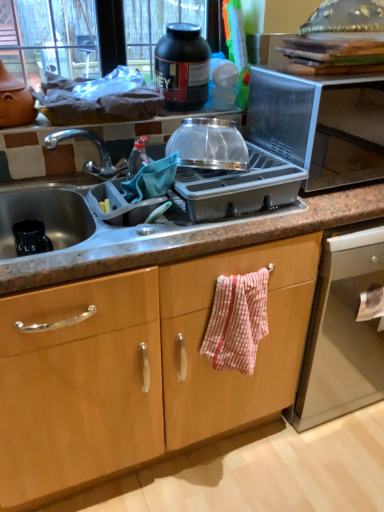
Question: Is red and white checkered fabric at center further to camera compared to granite gray sink at center?

Choices:
 (A) no
 (B) yes

Answer: (B)

Question: From the image's perspective, would you say red and white checkered fabric at center is shown under granite gray sink at center?

Choices:
 (A) yes
 (B) no

Answer: (A)

Question: Is red and white checkered fabric at center facing away from granite gray sink at center?

Choices:
 (A) no
 (B) yes

Answer: (B)

Question: Considering the relative sizes of red and white checkered fabric at center and granite gray sink at center in the image provided, is red and white checkered fabric at center smaller than granite gray sink at center?

Choices:
 (A) yes
 (B) no

Answer: (A)

Question: Is red and white checkered fabric at center facing towards granite gray sink at center?

Choices:
 (A) yes
 (B) no

Answer: (B)

Question: Is granite gray sink at center situated inside black plastic jar at upper center, the first kitchen appliance viewed from the top, or outside?

Choices:
 (A) inside
 (B) outside

Answer: (B)

Question: In the image, is granite gray sink at center positioned in front of or behind black plastic jar at upper center, the first kitchen appliance viewed from the top?

Choices:
 (A) behind
 (B) front

Answer: (B)

Question: Looking at the image, does granite gray sink at center seem bigger or smaller compared to black plastic jar at upper center, positioned as the 2th kitchen appliance in bottom-to-top order?

Choices:
 (A) small
 (B) big

Answer: (B)

Question: Visually, is granite gray sink at center positioned to the left or to the right of black plastic jar at upper center, positioned as the 2th kitchen appliance in bottom-to-top order?

Choices:
 (A) left
 (B) right

Answer: (A)

Question: From a real-world perspective, is transparent plastic bowl at upper center, the first kitchen appliance ordered from the bottom, above or below transparent plastic microwave at upper right?

Choices:
 (A) above
 (B) below

Answer: (A)

Question: Is transparent plastic bowl at upper center, arranged as the 2th kitchen appliance when viewed from the top, taller or shorter than transparent plastic microwave at upper right?

Choices:
 (A) short
 (B) tall

Answer: (A)

Question: Visually, is transparent plastic bowl at upper center, which is the first kitchen appliance from front to back, positioned to the left or to the right of transparent plastic microwave at upper right?

Choices:
 (A) right
 (B) left

Answer: (B)

Question: Would you say transparent plastic bowl at upper center, the first kitchen appliance ordered from the bottom, is inside or outside transparent plastic microwave at upper right?

Choices:
 (A) inside
 (B) outside

Answer: (B)

Question: Considering the positions of transparent plastic bowl at upper center, the second kitchen appliance in the back-to-front sequence, and red and white checkered fabric at center in the image, is transparent plastic bowl at upper center, the second kitchen appliance in the back-to-front sequence, taller or shorter than red and white checkered fabric at center?

Choices:
 (A) tall
 (B) short

Answer: (B)

Question: Is point (203, 136) closer or farther from the camera than point (231, 340)?

Choices:
 (A) farther
 (B) closer

Answer: (B)